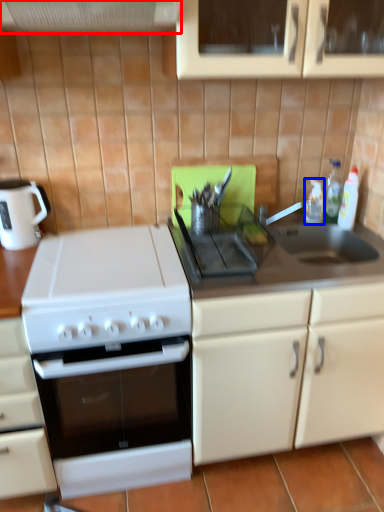
Question: Which object appears farthest to the camera in this image, exhaust hood (highlighted by a red box) or bottle (highlighted by a blue box)?

Choices:
 (A) exhaust hood
 (B) bottle

Answer: (B)